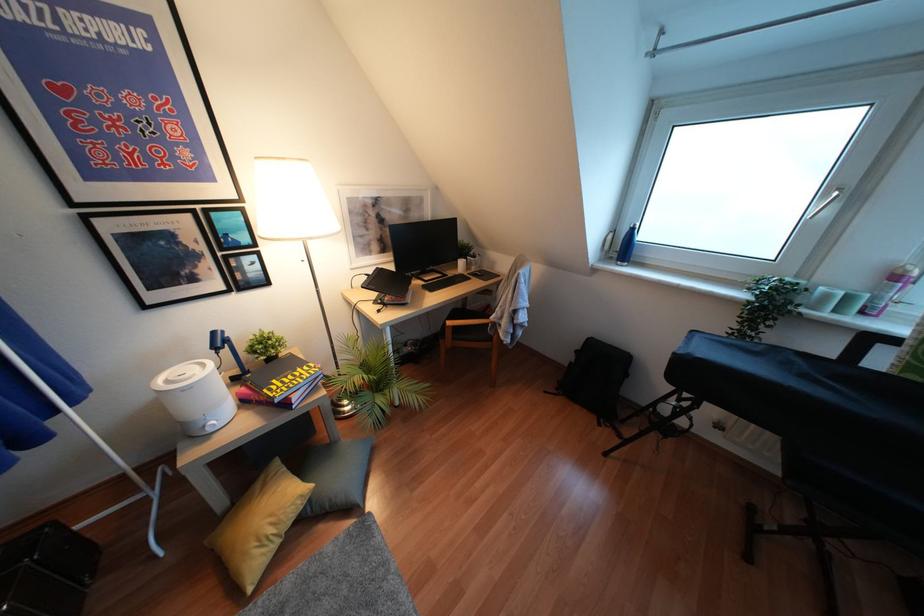
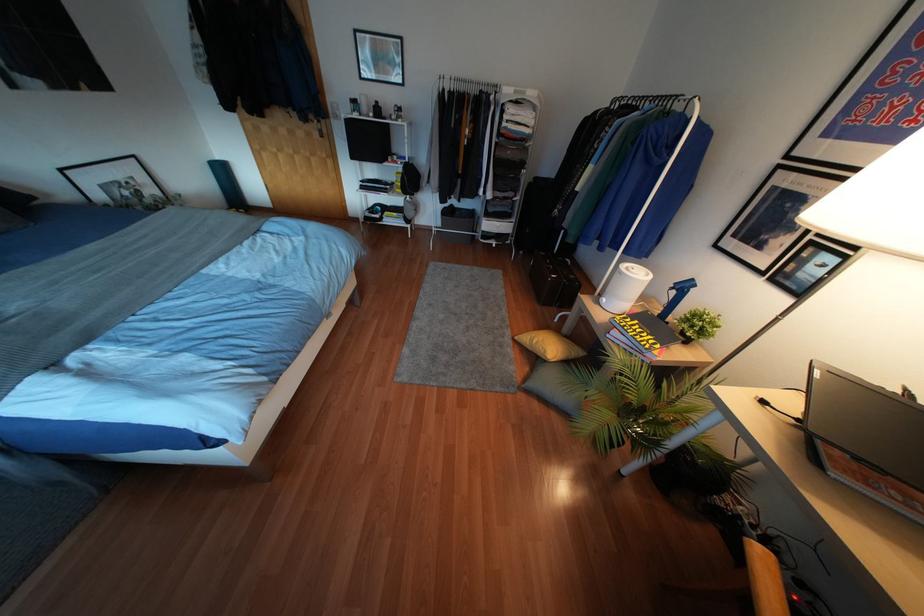
Find the pixel in the second image that matches the point at 213,333 in the first image.

(690, 280)